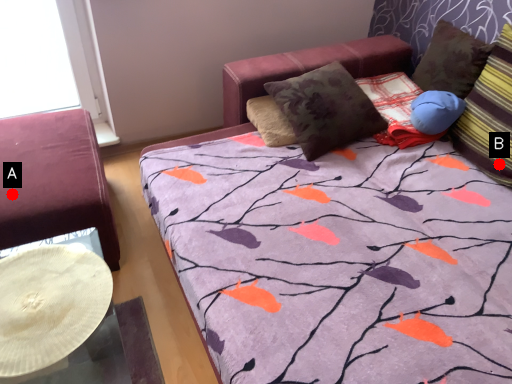
Question: Two points are circled on the image, labeled by A and B beside each circle. Which point is closer to the camera?

Choices:
 (A) A is closer
 (B) B is closer

Answer: (A)